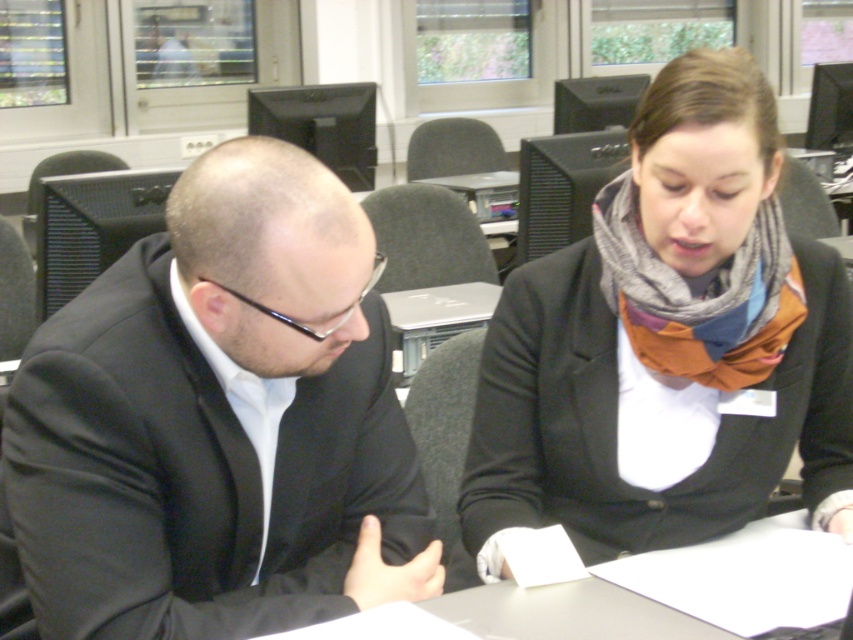
Question: Which point is closer to the camera?

Choices:
 (A) (36, 506)
 (B) (636, 342)

Answer: (A)

Question: Which point is farther to the camera?

Choices:
 (A) knitted scarf at center
 (B) black matte suit at left

Answer: (A)

Question: Does black matte suit at left have a lesser width compared to knitted scarf at center?

Choices:
 (A) no
 (B) yes

Answer: (B)

Question: Which point is closer to the camera?

Choices:
 (A) (650, 422)
 (B) (335, 209)

Answer: (B)

Question: Does black matte suit at left come in front of knitted scarf at center?

Choices:
 (A) no
 (B) yes

Answer: (B)

Question: Is black matte suit at left further to camera compared to knitted scarf at center?

Choices:
 (A) yes
 (B) no

Answer: (B)